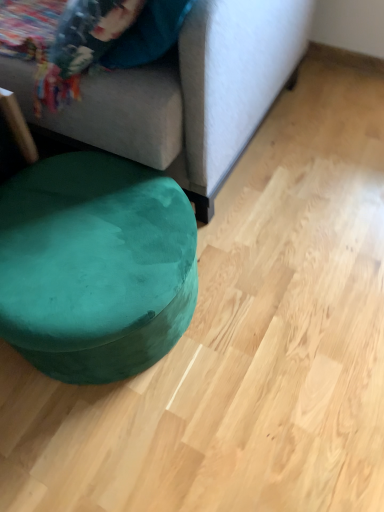
Question: Is suede gray couch at upper left with velvet green bean bag at lower left?

Choices:
 (A) no
 (B) yes

Answer: (A)

Question: Is suede gray couch at upper left positioned behind velvet green bean bag at lower left?

Choices:
 (A) no
 (B) yes

Answer: (A)

Question: Can velvet green bean bag at lower left be found inside suede gray couch at upper left?

Choices:
 (A) no
 (B) yes

Answer: (A)

Question: Is suede gray couch at upper left wider than velvet green bean bag at lower left?

Choices:
 (A) yes
 (B) no

Answer: (A)

Question: Is suede gray couch at upper left to the left of velvet green bean bag at lower left from the viewer's perspective?

Choices:
 (A) yes
 (B) no

Answer: (A)

Question: Considering the relative sizes of suede gray couch at upper left and velvet green bean bag at lower left in the image provided, is suede gray couch at upper left thinner than velvet green bean bag at lower left?

Choices:
 (A) no
 (B) yes

Answer: (A)

Question: Does velvet green bean bag at lower left have a lesser height compared to suede gray couch at upper left?

Choices:
 (A) no
 (B) yes

Answer: (B)

Question: Does velvet green bean bag at lower left come in front of suede gray couch at upper left?

Choices:
 (A) yes
 (B) no

Answer: (B)

Question: Does velvet green bean bag at lower left have a greater width compared to suede gray couch at upper left?

Choices:
 (A) no
 (B) yes

Answer: (A)

Question: Is velvet green bean bag at lower left further to camera compared to suede gray couch at upper left?

Choices:
 (A) yes
 (B) no

Answer: (A)

Question: Considering the relative sizes of velvet green bean bag at lower left and suede gray couch at upper left in the image provided, is velvet green bean bag at lower left smaller than suede gray couch at upper left?

Choices:
 (A) no
 (B) yes

Answer: (B)

Question: Considering the relative sizes of velvet green bean bag at lower left and suede gray couch at upper left in the image provided, is velvet green bean bag at lower left bigger than suede gray couch at upper left?

Choices:
 (A) no
 (B) yes

Answer: (A)

Question: Is velvet green bean bag at lower left inside the boundaries of suede gray couch at upper left, or outside?

Choices:
 (A) inside
 (B) outside

Answer: (B)